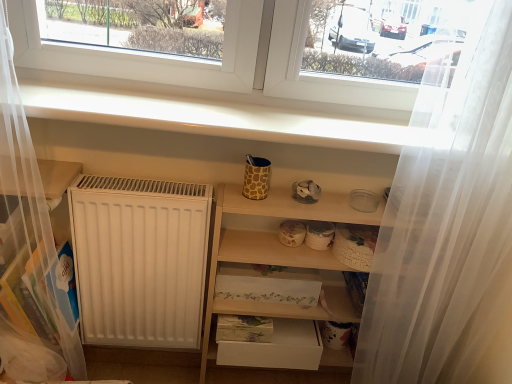
Question: Is white sheer curtain at right inside the boundaries of white matte drawer at lower center, or outside?

Choices:
 (A) inside
 (B) outside

Answer: (B)

Question: Looking at the image, does white sheer curtain at right seem bigger or smaller compared to white matte drawer at lower center?

Choices:
 (A) big
 (B) small

Answer: (A)

Question: Based on their relative distances, which object is nearer to the white sheer curtain at right?

Choices:
 (A) wooden shelves at center
 (B) white smooth window sill at upper center
 (C) white matte drawer at lower center

Answer: (A)

Question: Estimate the real-world distances between objects in this image. Which object is closer to the white sheer curtain at right?

Choices:
 (A) white matte drawer at lower center
 (B) white smooth window sill at upper center
 (C) wooden shelves at center

Answer: (C)